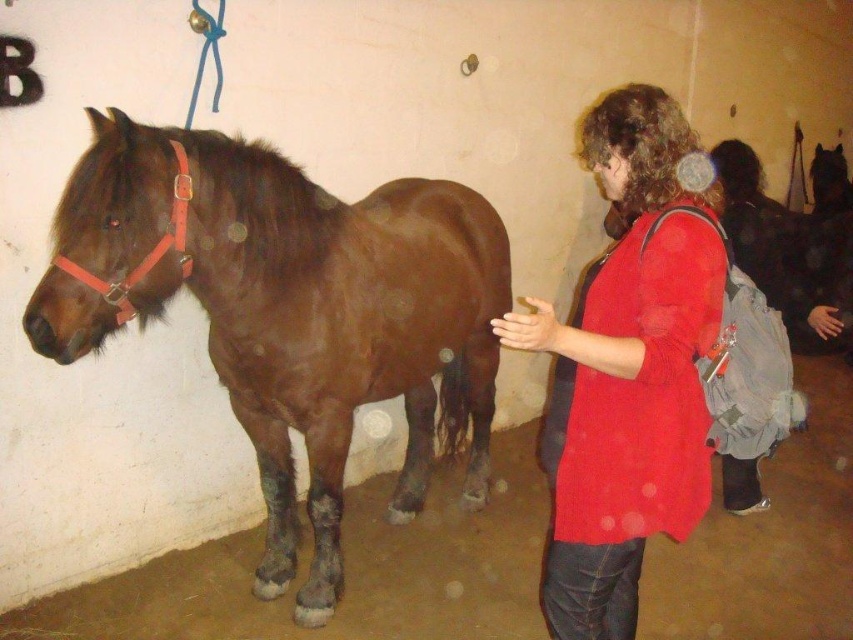
From the picture: Can you confirm if brown glossy horse at left is wider than matte red shirt at center?

Yes, brown glossy horse at left is wider than matte red shirt at center.

Is brown glossy horse at left to the right of matte red shirt at center from the viewer's perspective?

No, brown glossy horse at left is not to the right of matte red shirt at center.

Who is more distant from viewer, (119, 176) or (683, 272)?

The point (119, 176) is behind.

The width and height of the screenshot is (853, 640). In order to click on brown glossy horse at left in this screenshot , I will do `click(288, 308)`.